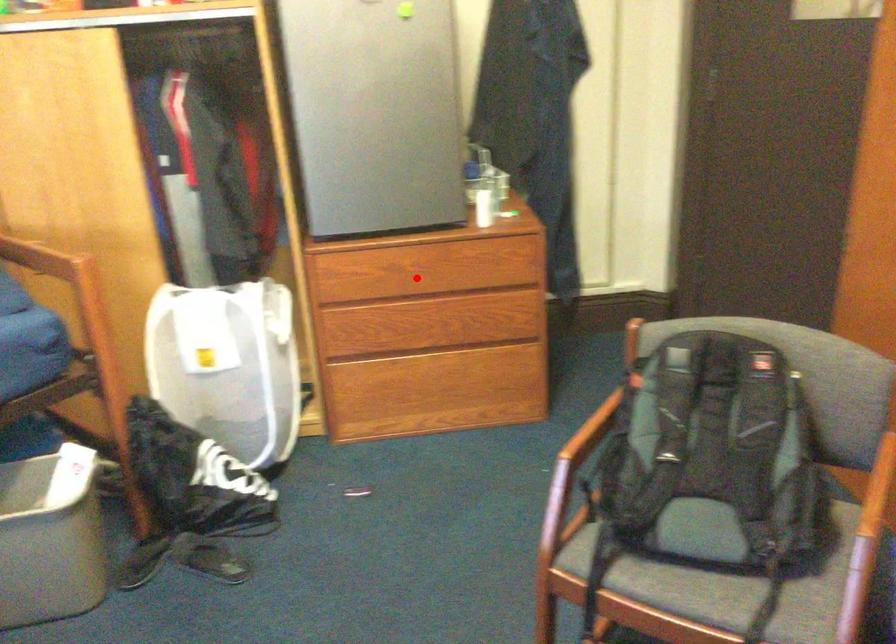
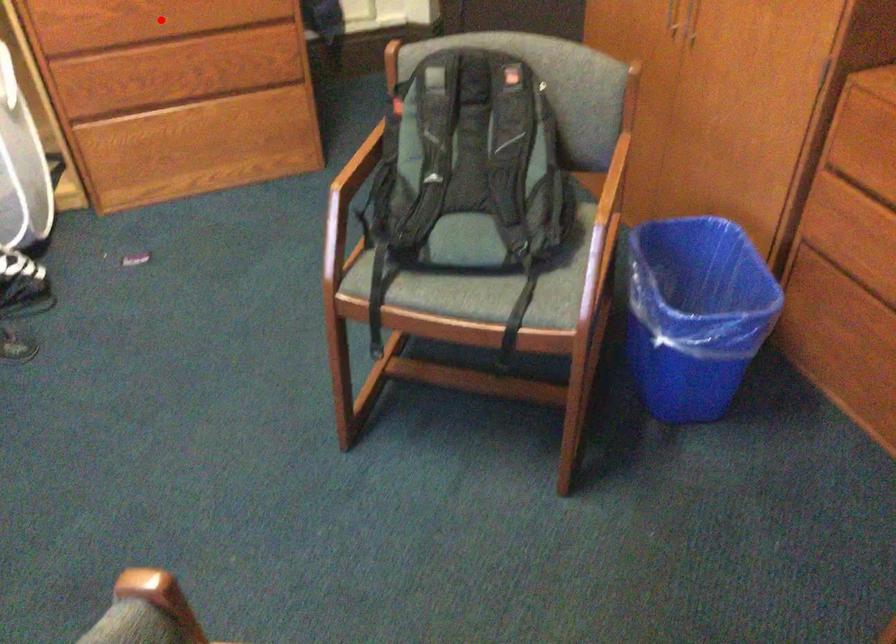
I am providing you with two images of the same scene from different viewpoints. A red point is marked on the first image and another point is marked on the second image. Do the highlighted points in image1 and image2 indicate the same real-world spot?

Yes